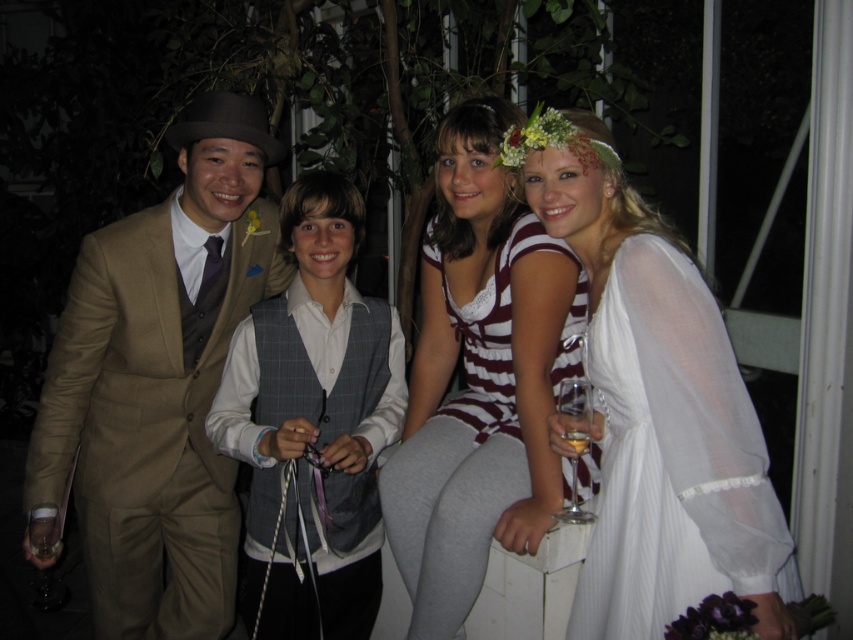
You are taking a photo of the group and want to focus on the two points in the image. Which point, point (614, 269) or point (264, 570), is closer to the camera?

Point (614, 269) is closer to the camera than point (264, 570).

In the scene shown: You are a photographer trying to adjust the lighting for a photo. You need to ensure that the white sheer dress at right is well lit. Based on the scene description, where should you position the light source relative to the dress?

The white sheer dress at right is located at point (660, 419). To ensure proper lighting, position the light source in front of the dress to illuminate it effectively while keeping the background darker as described.

You are a photographer setting up for an evening event. You have a matte brown suit at left and a clear glass wine glass at lower right in your frame. Which object occupies more horizontal space in the image?

The matte brown suit at left occupies more horizontal space in the image because its width surpasses that of the clear glass wine glass at lower right.